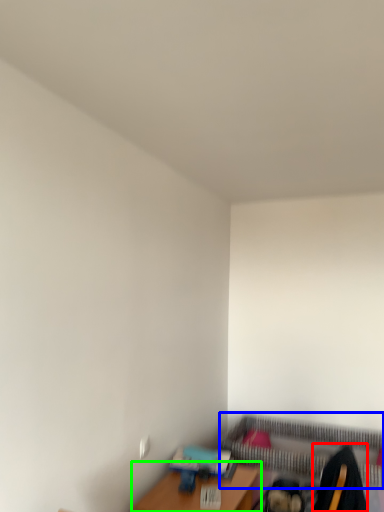
Question: Which is nearer to the swivel chair (highlighted by a red box)? bed frame (highlighted by a blue box) or table (highlighted by a green box).

Choices:
 (A) bed frame
 (B) table

Answer: (B)